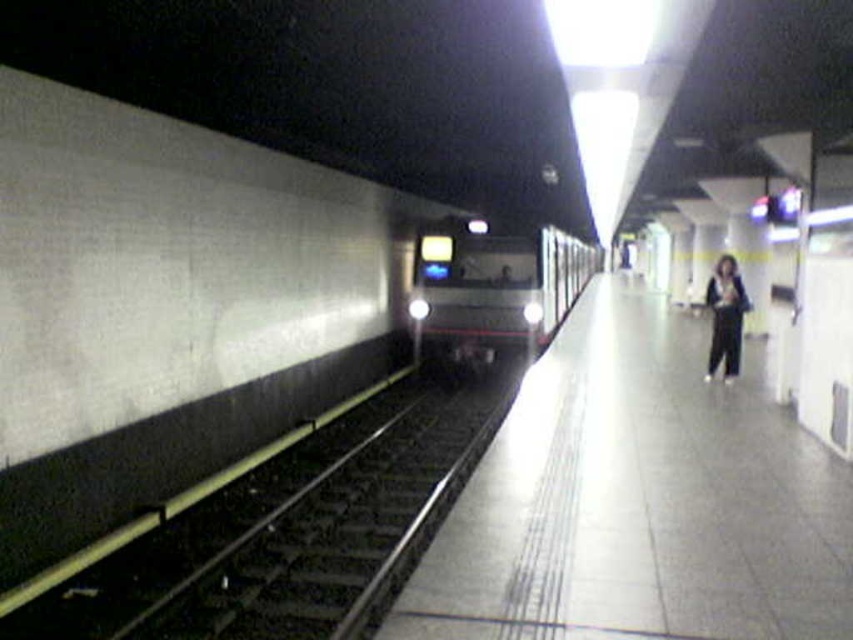
This screenshot has width=853, height=640. What do you see at coordinates (639, 500) in the screenshot?
I see `smooth concrete platform at center` at bounding box center [639, 500].

Who is shorter, smooth concrete platform at center or metallic silver train at center?

smooth concrete platform at center

This screenshot has width=853, height=640. In order to click on smooth concrete platform at center in this screenshot , I will do (x=639, y=500).

The image size is (853, 640). I want to click on smooth concrete platform at center, so click(x=639, y=500).

Who is lower down, black metal train track at center or metallic silver train at center?

black metal train track at center

Does black metal train track at center have a larger size compared to metallic silver train at center?

Incorrect, black metal train track at center is not larger than metallic silver train at center.

Identify the location of black metal train track at center. (339, 531).

Does smooth concrete platform at center appear on the right side of black metal train track at center?

Indeed, smooth concrete platform at center is positioned on the right side of black metal train track at center.

Which of these two, smooth concrete platform at center or black metal train track at center, stands shorter?

black metal train track at center

Between point (752, 502) and point (219, 554), which one is positioned in front?

Point (752, 502)

Where is `smooth concrete platform at center`? smooth concrete platform at center is located at coordinates (639, 500).